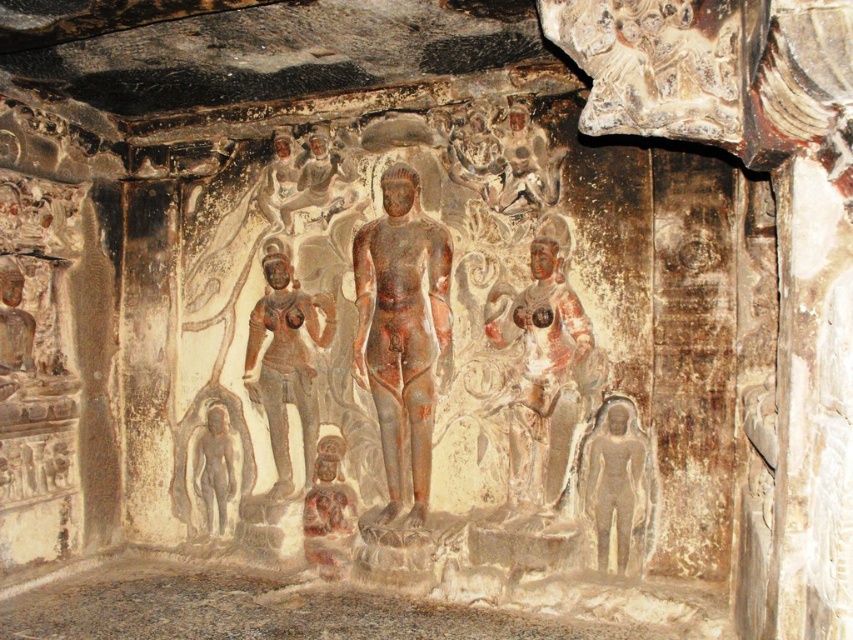
Question: Which point is farther to the camera?

Choices:
 (A) (552, 374)
 (B) (326, 308)

Answer: (B)

Question: Which point is closer to the camera taking this photo?

Choices:
 (A) (421, 424)
 (B) (224, 532)
 (C) (540, 316)
 (D) (599, 538)

Answer: (C)

Question: Does reddish-brown stone statue at center-right appear over gray stone statue at lower right?

Choices:
 (A) yes
 (B) no

Answer: (A)

Question: Considering the real-world distances, which object is farthest from the gray stone statue at lower right?

Choices:
 (A) brown stone statue at center
 (B) dark gray stone statue at center
 (C) smooth gray statue at lower left
 (D) reddish-brown stone statue at center-right

Answer: (C)

Question: Can you confirm if reddish-brown stone statue at center-right is positioned above brown stone statue at center?

Choices:
 (A) yes
 (B) no

Answer: (B)

Question: Can you confirm if reddish-brown stone statue at center-right is positioned to the right of smooth gray statue at lower left?

Choices:
 (A) no
 (B) yes

Answer: (B)